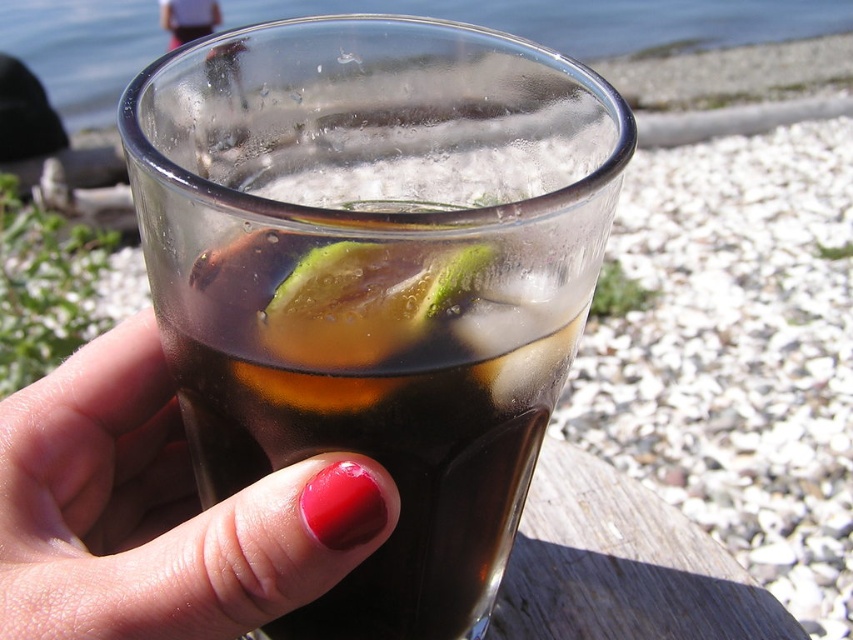
Question: In this image, where is dark glass at center located relative to glossy nail polish at center?

Choices:
 (A) right
 (B) left

Answer: (A)

Question: Does glossy nail polish at center lie in front of clear glass water at upper center?

Choices:
 (A) no
 (B) yes

Answer: (B)

Question: Which object appears closest to the camera in this image?

Choices:
 (A) clear glass water at upper center
 (B) dark glass at center
 (C) glossy nail polish at center

Answer: (B)

Question: Considering the real-world distances, which object is farthest from the glossy nail polish at center?

Choices:
 (A) dark glass at center
 (B) clear glass water at upper center

Answer: (B)

Question: From the image, what is the correct spatial relationship of dark glass at center in relation to clear glass water at upper center?

Choices:
 (A) above
 (B) below

Answer: (B)

Question: Among these objects, which one is farthest from the camera?

Choices:
 (A) clear glass water at upper center
 (B) dark glass at center
 (C) glossy nail polish at center

Answer: (A)